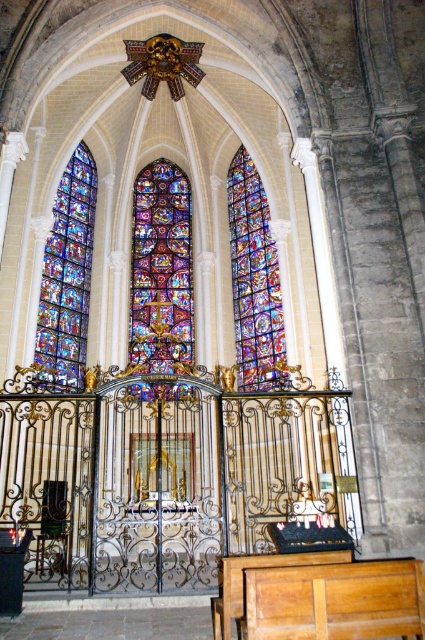
You are standing inside a Gothic church and want to take a closer look at the stained glass window at center. If you walk towards it, how far will you have to travel to reach it?

The stained glass window at center is 48.87 meters away from the viewer, so you will have to walk 48.87 meters to reach it.